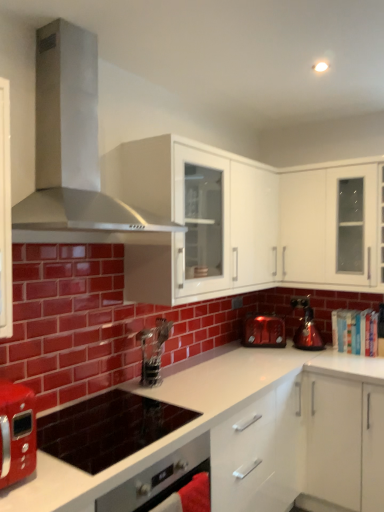
Question: Can you confirm if white glossy cabinet at upper right, which appears as the second cabinetry when viewed from the left, is shorter than metallic silver coffee machine at center?

Choices:
 (A) yes
 (B) no

Answer: (B)

Question: Is white glossy cabinet at upper right, which appears as the second cabinetry when viewed from the left, smaller than metallic silver coffee machine at center?

Choices:
 (A) no
 (B) yes

Answer: (A)

Question: From a real-world perspective, is white glossy cabinet at upper right, positioned as the first cabinetry in right-to-left order, positioned over metallic silver coffee machine at center based on gravity?

Choices:
 (A) yes
 (B) no

Answer: (A)

Question: Could metallic silver coffee machine at center be considered to be inside white glossy cabinet at upper right, positioned as the first cabinetry in right-to-left order?

Choices:
 (A) yes
 (B) no

Answer: (B)

Question: Does white glossy cabinet at upper right, which appears as the second cabinetry when viewed from the left, appear on the right side of metallic silver coffee machine at center?

Choices:
 (A) no
 (B) yes

Answer: (B)

Question: Does white glossy cabinet at upper right, which appears as the second cabinetry when viewed from the left, have a larger size compared to metallic silver coffee machine at center?

Choices:
 (A) no
 (B) yes

Answer: (B)

Question: Considering the relative sizes of shiny metallic kettle at right, the second kitchen appliance from the left, and white glossy cabinet at upper right, which appears as the second cabinetry when viewed from the left, in the image provided, is shiny metallic kettle at right, the second kitchen appliance from the left, shorter than white glossy cabinet at upper right, which appears as the second cabinetry when viewed from the left,?

Choices:
 (A) no
 (B) yes

Answer: (B)

Question: Is shiny metallic kettle at right, the second kitchen appliance from the left, not within white glossy cabinet at upper right, positioned as the first cabinetry in right-to-left order?

Choices:
 (A) yes
 (B) no

Answer: (A)

Question: Is shiny metallic kettle at right, the second kitchen appliance from the left, facing towards white glossy cabinet at upper right, which appears as the second cabinetry when viewed from the left?

Choices:
 (A) yes
 (B) no

Answer: (B)

Question: Does shiny metallic kettle at right, positioned as the 1th kitchen appliance in right-to-left order, have a larger size compared to white glossy cabinet at upper right, which appears as the second cabinetry when viewed from the left?

Choices:
 (A) yes
 (B) no

Answer: (B)

Question: From a real-world perspective, is shiny metallic kettle at right, positioned as the 1th kitchen appliance in right-to-left order, located beneath white glossy cabinet at upper right, positioned as the first cabinetry in right-to-left order?

Choices:
 (A) no
 (B) yes

Answer: (B)

Question: Considering the relative positions of shiny metallic kettle at right, the second kitchen appliance from the left, and white glossy cabinet at upper right, which appears as the second cabinetry when viewed from the left, in the image provided, is shiny metallic kettle at right, the second kitchen appliance from the left, to the left of white glossy cabinet at upper right, which appears as the second cabinetry when viewed from the left, from the viewer's perspective?

Choices:
 (A) yes
 (B) no

Answer: (A)

Question: Is matte red toaster at center, placed as the 2th kitchen appliance when sorted from right to left, not near white glossy countertop at center?

Choices:
 (A) no
 (B) yes

Answer: (A)